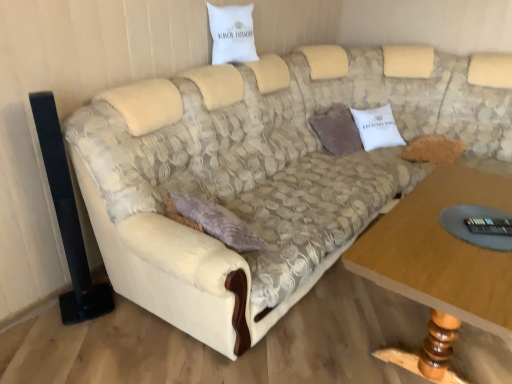
Question: Is transparent glass remote control at lower right outside of wooden table at lower right?

Choices:
 (A) yes
 (B) no

Answer: (B)

Question: From the image's perspective, is transparent glass remote control at lower right located above wooden table at lower right?

Choices:
 (A) yes
 (B) no

Answer: (A)

Question: Are transparent glass remote control at lower right and wooden table at lower right far apart?

Choices:
 (A) no
 (B) yes

Answer: (A)

Question: Is transparent glass remote control at lower right positioned behind wooden table at lower right?

Choices:
 (A) no
 (B) yes

Answer: (B)

Question: Can you confirm if transparent glass remote control at lower right is shorter than wooden table at lower right?

Choices:
 (A) yes
 (B) no

Answer: (A)

Question: From a real-world perspective, is beige fabric couch at center above or below white fabric pillow at upper center, the second pillow from the right?

Choices:
 (A) below
 (B) above

Answer: (A)

Question: Does point (473, 77) appear closer or farther from the camera than point (221, 51)?

Choices:
 (A) farther
 (B) closer

Answer: (A)

Question: In terms of height, does beige fabric couch at center look taller or shorter compared to white fabric pillow at upper center, acting as the first pillow starting from the front?

Choices:
 (A) short
 (B) tall

Answer: (B)

Question: Is beige fabric couch at center to the left or to the right of white fabric pillow at upper center, marked as the second pillow in a bottom-to-top arrangement, in the image?

Choices:
 (A) right
 (B) left

Answer: (A)

Question: From a real-world perspective, is transparent glass remote control at lower right physically located above or below wooden table at lower right?

Choices:
 (A) below
 (B) above

Answer: (B)

Question: Choose the correct answer: Is transparent glass remote control at lower right inside wooden table at lower right or outside it?

Choices:
 (A) outside
 (B) inside

Answer: (B)

Question: In terms of size, does transparent glass remote control at lower right appear bigger or smaller than wooden table at lower right?

Choices:
 (A) big
 (B) small

Answer: (B)

Question: In terms of width, does transparent glass remote control at lower right look wider or thinner when compared to wooden table at lower right?

Choices:
 (A) thin
 (B) wide

Answer: (A)

Question: Is fuzzy brown pillow at right, placed as the first pillow when sorted from bottom to top, inside or outside of wooden table at lower right?

Choices:
 (A) inside
 (B) outside

Answer: (B)

Question: Visually, is fuzzy brown pillow at right, acting as the first pillow starting from the right, positioned to the left or to the right of wooden table at lower right?

Choices:
 (A) left
 (B) right

Answer: (B)